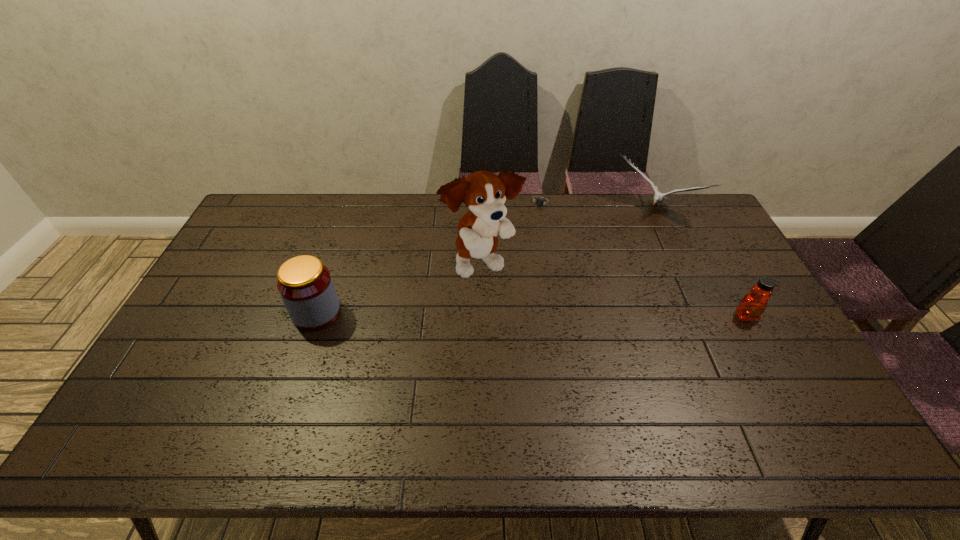
Identify the location of free space on the desktop that is between the jar and the second shortest object and is positioned on the face of the tallest object. This screenshot has height=540, width=960. (538, 314).

Where is `vacant space on the desktop that is between the jar and the honey and is positioned on the face of the shortest object`? The height and width of the screenshot is (540, 960). vacant space on the desktop that is between the jar and the honey and is positioned on the face of the shortest object is located at coordinates (467, 314).

The height and width of the screenshot is (540, 960). In order to click on free space on the desktop that is between the jar and the honey and is positioned at the tip of the beak of the gull in this screenshot , I will do `click(583, 315)`.